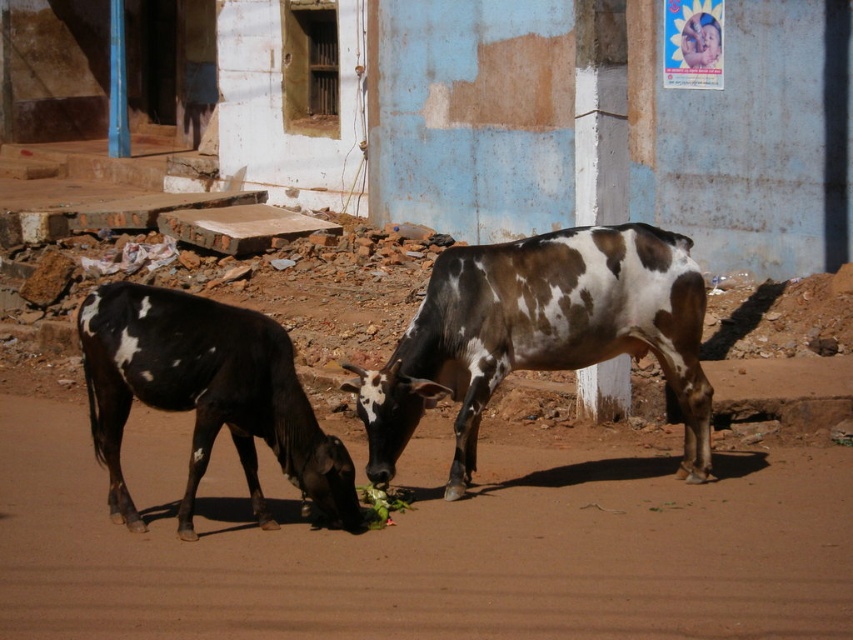
Question: Which point is farther from the camera taking this photo?

Choices:
 (A) (413, 374)
 (B) (178, 506)

Answer: (A)

Question: Is brown spotted cow at center further to camera compared to black and white spotted cow at left?

Choices:
 (A) yes
 (B) no

Answer: (A)

Question: Does brown dirt track at center appear on the right side of black and white spotted cow at left?

Choices:
 (A) yes
 (B) no

Answer: (A)

Question: Among these points, which one is farthest from the camera?

Choices:
 (A) click(93, 326)
 (B) click(492, 372)

Answer: (B)

Question: Observing the image, what is the correct spatial positioning of brown spotted cow at center in reference to black and white spotted cow at left?

Choices:
 (A) below
 (B) above

Answer: (B)

Question: Which object is the closest to the brown dirt track at center?

Choices:
 (A) brown spotted cow at center
 (B) black and white spotted cow at left

Answer: (B)